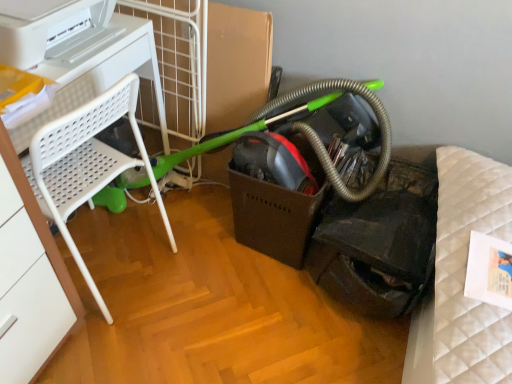
The height and width of the screenshot is (384, 512). In order to click on vacant area that is in front of green rubber garden hose at center in this screenshot , I will do `click(212, 301)`.